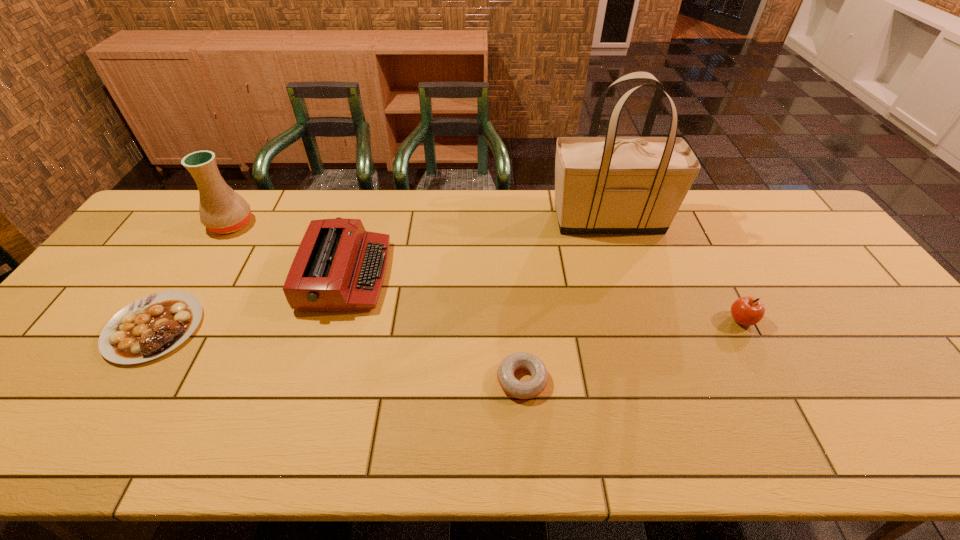
This screenshot has width=960, height=540. Identify the location of the fifth object from left to right. (610, 184).

Find the location of a particular element. The width and height of the screenshot is (960, 540). shopping bag is located at coordinates (610, 184).

This screenshot has height=540, width=960. In order to click on the second tallest object in this screenshot , I will do `click(222, 210)`.

The image size is (960, 540). I want to click on typewriter, so click(339, 266).

Where is `apple`? apple is located at coordinates (747, 311).

You are a GUI agent. You are given a task and a screenshot of the screen. Output one action in this format:
    pyautogui.click(x=<x>, y=<y>)
    Task: Click on the steak
    
    Given the screenshot: What is the action you would take?
    pyautogui.click(x=152, y=326)

The image size is (960, 540). Find the location of `the fourth object from left to right`. the fourth object from left to right is located at coordinates (533, 387).

Locate an element on the screen. The width and height of the screenshot is (960, 540). free space located 0.090m with handles facing forward on the shopping bag is located at coordinates (521, 220).

You are a GUI agent. You are given a task and a screenshot of the screen. Output one action in this format:
    pyautogui.click(x=<x>, y=<y>)
    Task: Click on the free space located with handles facing forward on the shopping bag
    This screenshot has width=960, height=540.
    Given the screenshot: What is the action you would take?
    pyautogui.click(x=524, y=220)

This screenshot has width=960, height=540. Find the location of `free location located with handles facing forward on the shopping bag`. free location located with handles facing forward on the shopping bag is located at coordinates (494, 220).